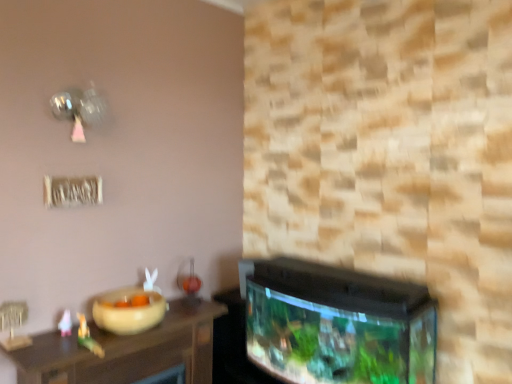
Find the location of a particular element. free space in front of pink paper airplane at lower left, which is the second toy in right-to-left order is located at coordinates (42, 351).